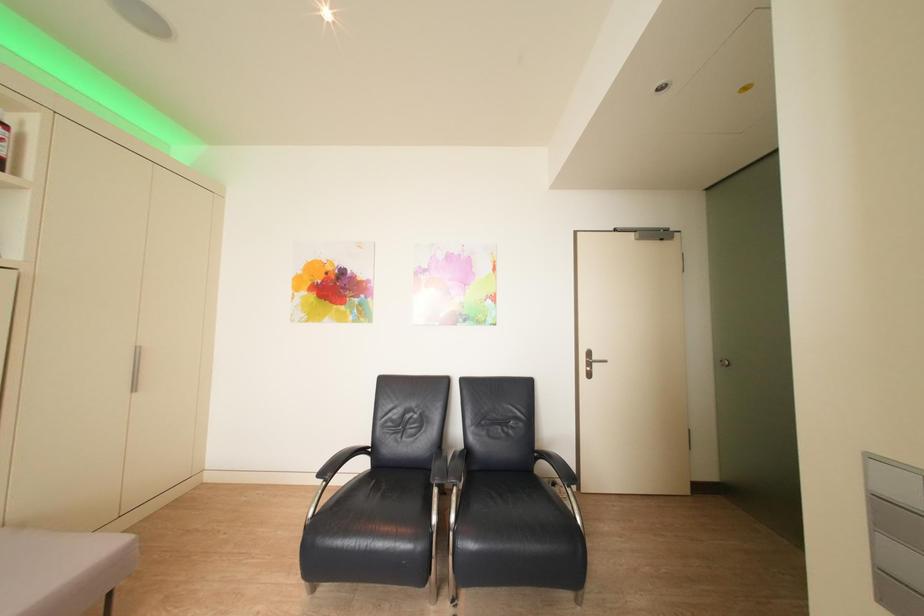
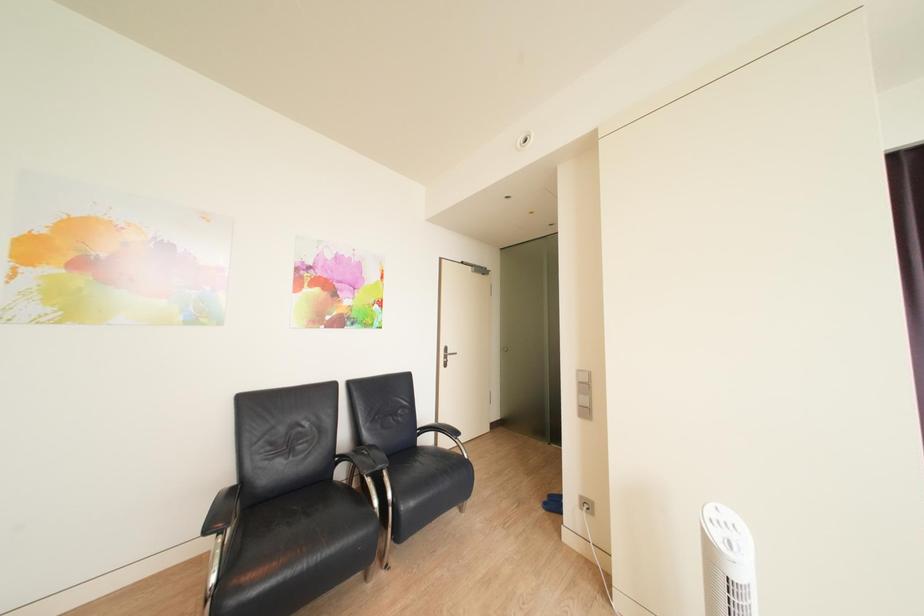
Question: How did the camera likely rotate?

Choices:
 (A) Left
 (B) Right
 (C) Up
 (D) Down

Answer: (B)